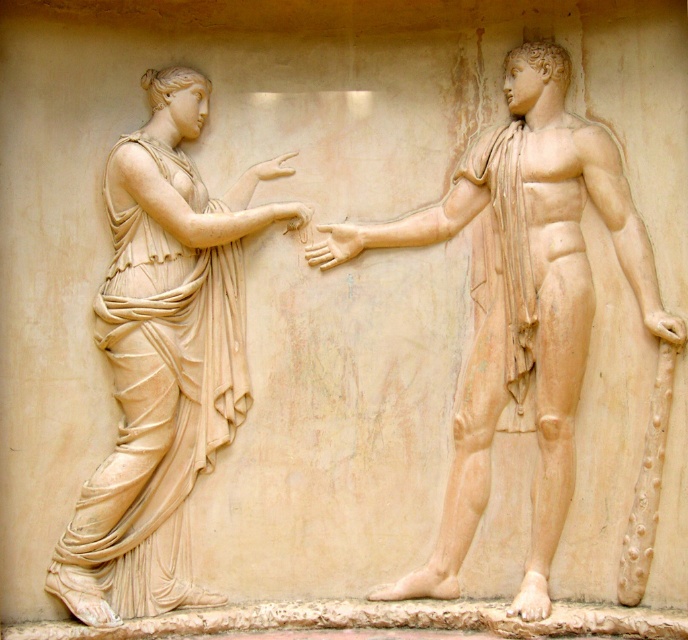
Question: Is marble statue at right to the right of matte beige draped figure at left from the viewer's perspective?

Choices:
 (A) no
 (B) yes

Answer: (B)

Question: Does marble statue at right appear over matte beige draped figure at left?

Choices:
 (A) yes
 (B) no

Answer: (A)

Question: In this image, where is marble statue at right located relative to matte beige draped figure at left?

Choices:
 (A) below
 (B) above

Answer: (B)

Question: Among these points, which one is farthest from the camera?

Choices:
 (A) (462, 179)
 (B) (172, 180)

Answer: (A)